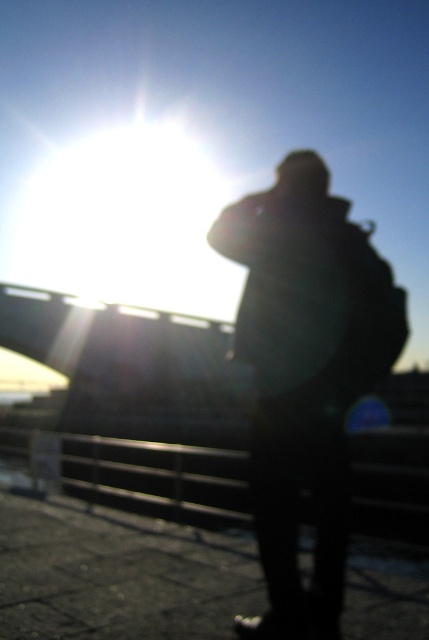
Question: Can you confirm if black matte jacket at center is positioned below metallic silver rail at lower center?

Choices:
 (A) no
 (B) yes

Answer: (A)

Question: Which of these objects is positioned farthest from the metallic silver rail at lower center?

Choices:
 (A) metallic bridge at center
 (B) black matte jacket at center

Answer: (B)

Question: Which of the following is the farthest from the observer?

Choices:
 (A) (181, 499)
 (B) (84, 385)
 (C) (262, 484)

Answer: (B)

Question: Which point is farther to the camera?

Choices:
 (A) metallic bridge at center
 (B) metallic silver rail at lower center

Answer: (A)

Question: Is metallic bridge at center to the left of metallic silver rail at lower center from the viewer's perspective?

Choices:
 (A) no
 (B) yes

Answer: (A)

Question: In this image, where is black matte jacket at center located relative to metallic silver rail at lower center?

Choices:
 (A) right
 (B) left

Answer: (A)